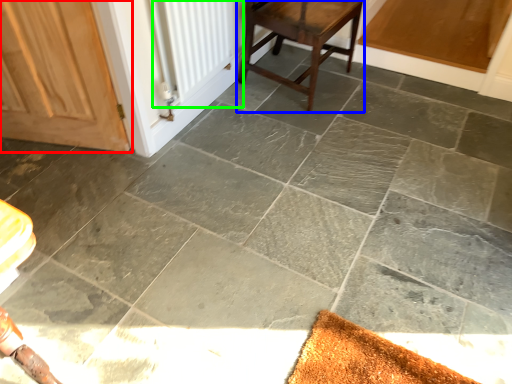
Question: Which object is positioned farthest from door (highlighted by a red box)? Select from stool (highlighted by a blue box) and radiator (highlighted by a green box).

Choices:
 (A) stool
 (B) radiator

Answer: (A)